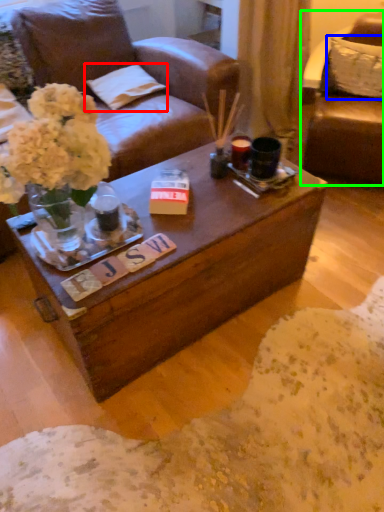
Question: Considering the real-world distances, which object is closest to pillow (highlighted by a red box)? pillow (highlighted by a blue box) or chair (highlighted by a green box).

Choices:
 (A) pillow
 (B) chair

Answer: (B)